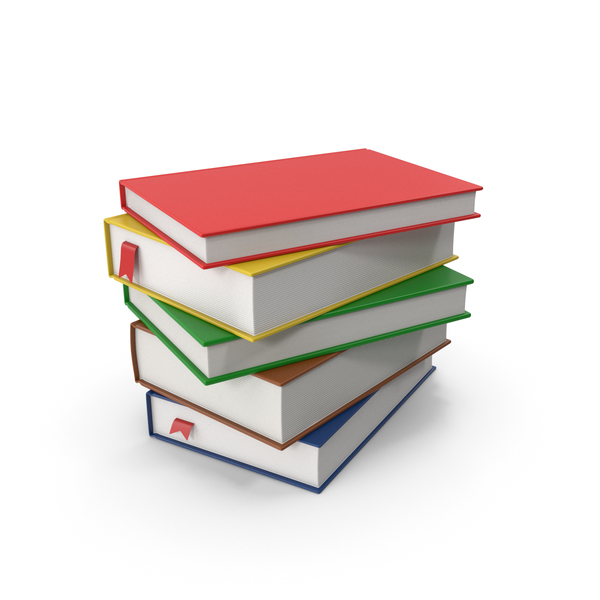
I want to click on thin books, so click(x=288, y=345), click(x=323, y=232).